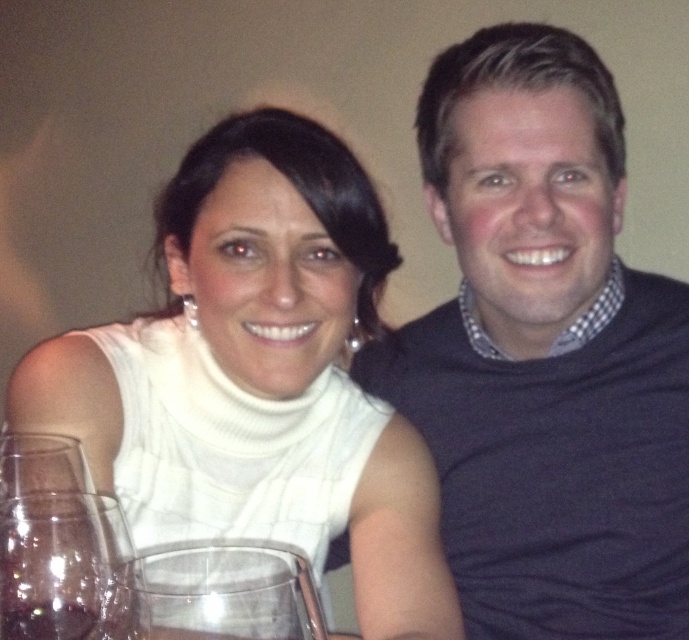
Looking at this image, you are a photographer setting up for a portrait. You notice the dark gray sweater at upper right and the transparent glass wine glass at lower left in the frame. Which object should you adjust to avoid it blocking the other?

The dark gray sweater at upper right is larger in size than the transparent glass wine glass at lower left, so you should adjust the transparent glass wine glass at lower left to prevent it from being obscured by the larger sweater.

You are a photographer adjusting the focus on your camera. You want to ensure that both the dark gray sweater at upper right and the other person in the image are in sharp focus. Given that the camera can only focus clearly on objects within a 1 meter range from the current focal point, where should you set the focal point to achieve this?

The dark gray sweater at upper right is 84.55 centimeters from the camera. To ensure both it and the other person are in focus, set the focal point at the midpoint between them. Since the sweater is within the 1 meter range, adjusting the focus to center between them ensures both are within the 1 meter focus range.

You are a bartender preparing drinks for a couple seated in front of you. You see the transparent glass wine glass at lower left. Can you reach it without moving your position?

The transparent glass wine glass at lower left is 14.78 inches away from the viewer, so yes, the bartender can reach it without moving since it is within a typical arm reach distance.